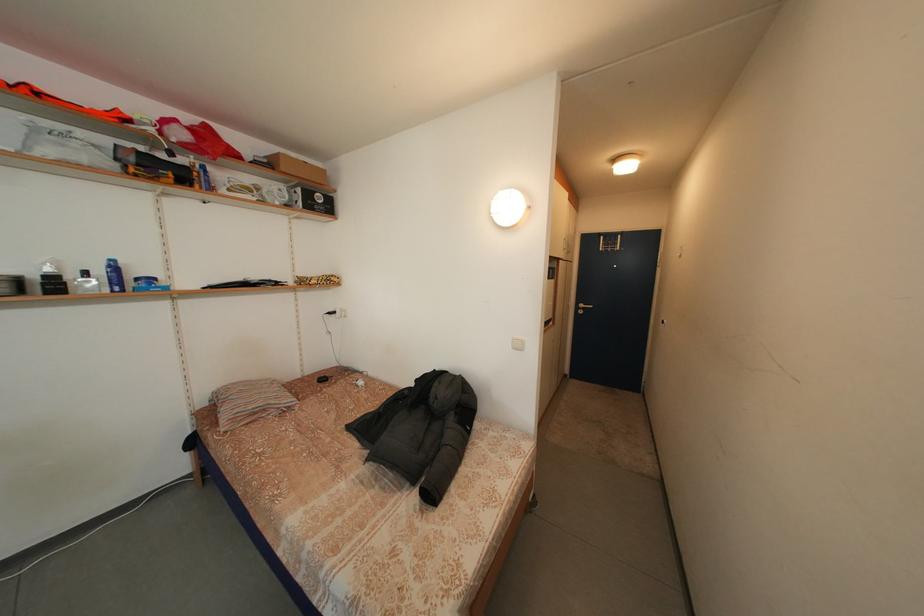
The height and width of the screenshot is (616, 924). What do you see at coordinates (144, 284) in the screenshot? I see `the blue jar lid` at bounding box center [144, 284].